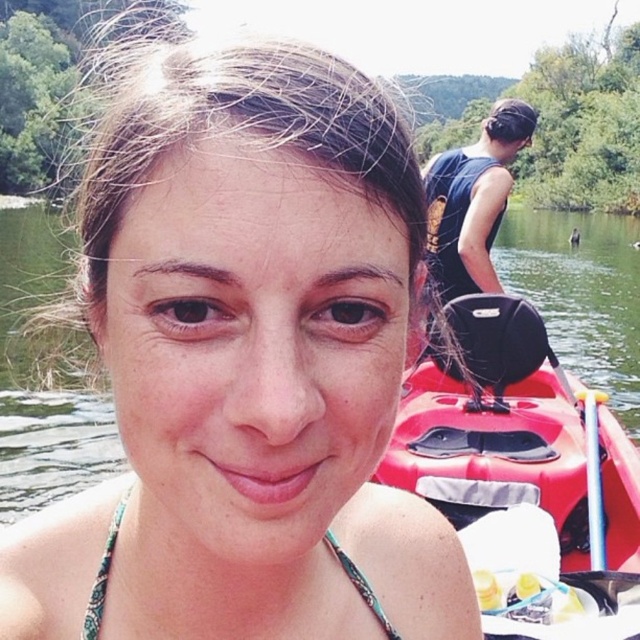
Is point (362, 577) behind point (586, 404)?

No, (362, 577) is closer to viewer.

Which is behind, point (380, 625) or point (604, 554)?

The point (604, 554) is more distant.

In order to click on green printed bikini top at center in this screenshot , I will do `click(102, 577)`.

Does matte black swimsuit at center have a lesser height compared to green printed bikini top at center?

In fact, matte black swimsuit at center may be taller than green printed bikini top at center.

Between point (401, 160) and point (113, 525), which one is positioned behind?

Point (113, 525)

You are a GUI agent. You are given a task and a screenshot of the screen. Output one action in this format:
    pyautogui.click(x=<x>, y=<y>)
    Task: Click on the matte black swimsuit at center
    
    Given the screenshot: What is the action you would take?
    pyautogui.click(x=243, y=362)

Can you confirm if matte black swimsuit at center is positioned to the left of silver metallic paddle at upper right?

Correct, you'll find matte black swimsuit at center to the left of silver metallic paddle at upper right.

Measure the distance between matte black swimsuit at center and camera.

A distance of 15.59 inches exists between matte black swimsuit at center and camera.

Describe the element at coordinates (243, 362) in the screenshot. This screenshot has width=640, height=640. I see `matte black swimsuit at center` at that location.

Locate an element on the screen. matte black swimsuit at center is located at coordinates (243, 362).